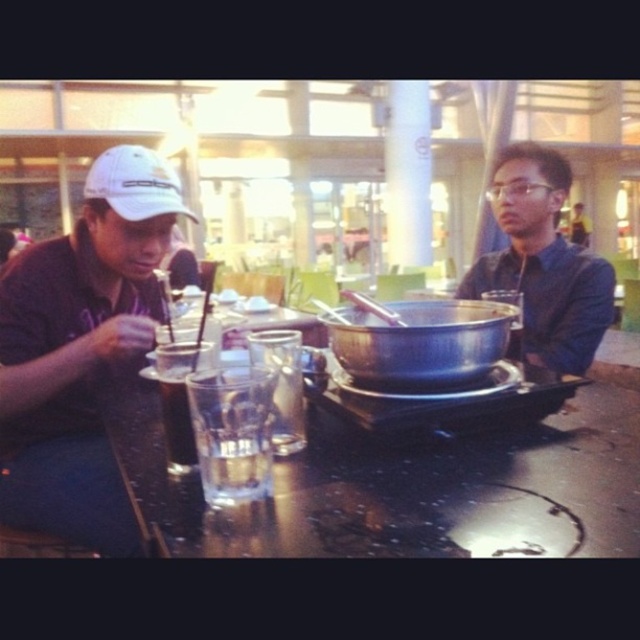
Which of these two, white matte baseball cap at left or dark brown carbonated drink at center, stands shorter?

dark brown carbonated drink at center is shorter.

Does white matte baseball cap at left appear on the left side of dark brown carbonated drink at center?

Yes, white matte baseball cap at left is to the left of dark brown carbonated drink at center.

Is point (131, 218) positioned before point (192, 348)?

No, (131, 218) is behind (192, 348).

At what (x,y) coordinates should I click in order to perform the action: click on white matte baseball cap at left. Please return your answer as a coordinate pair (x, y). The image size is (640, 640). Looking at the image, I should click on (134, 182).

Who is higher up, metallic silver pot at center or dark brown carbonated drink at center?

Positioned higher is metallic silver pot at center.

Is metallic silver pot at center to the left of dark brown carbonated drink at center from the viewer's perspective?

In fact, metallic silver pot at center is to the right of dark brown carbonated drink at center.

Locate an element on the screen. The image size is (640, 640). metallic silver pot at center is located at coordinates (420, 342).

Can you confirm if clear glass at center is thinner than white matte baseball cap at left?

Yes.

Is clear glass at center taller than white matte baseball cap at left?

In fact, clear glass at center may be shorter than white matte baseball cap at left.

Between point (260, 417) and point (176, 211), which one is positioned behind?

The point (176, 211) is more distant.

Image resolution: width=640 pixels, height=640 pixels. I want to click on clear glass at center, so click(232, 432).